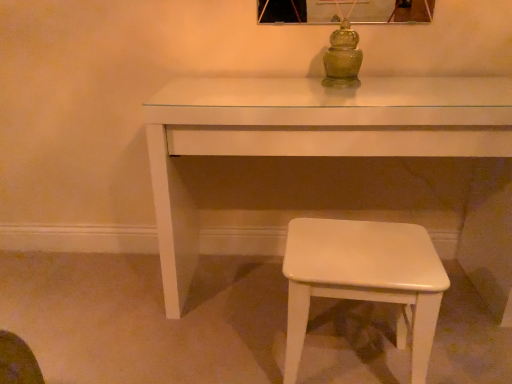
You are a GUI agent. You are given a task and a screenshot of the screen. Output one action in this format:
    pyautogui.click(x=<x>, y=<y>)
    Task: Click on the empty space that is to the right of green glass jar at center
    The width and height of the screenshot is (512, 384).
    Given the screenshot: What is the action you would take?
    pyautogui.click(x=380, y=87)